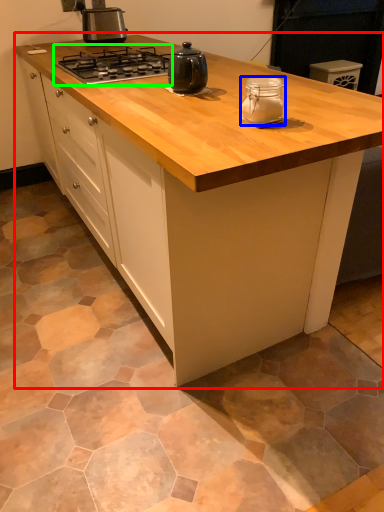
Question: Based on their relative distances, which object is nearer to cabinetry (highlighted by a red box)? Choose from kitchen appliance (highlighted by a blue box) and gas stove (highlighted by a green box).

Choices:
 (A) kitchen appliance
 (B) gas stove

Answer: (A)